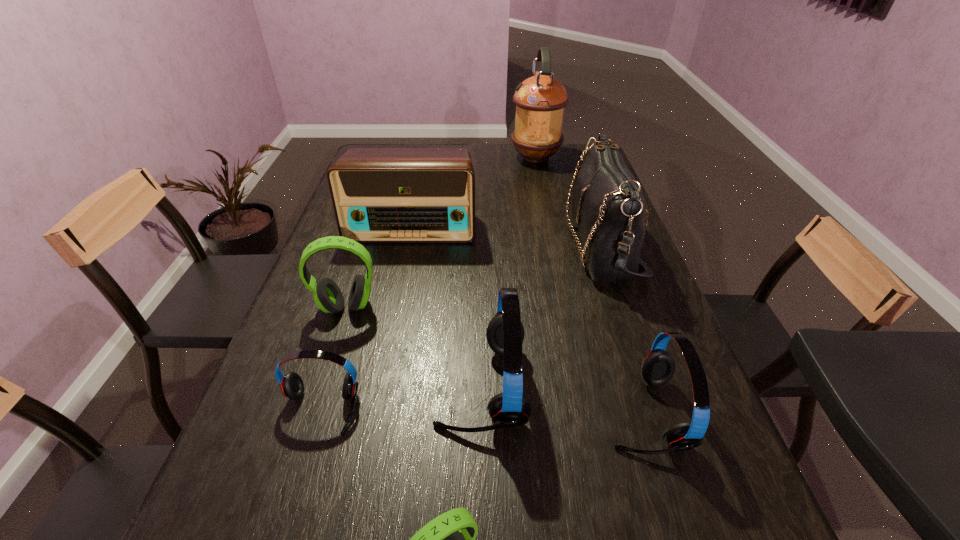
At what (x,y) coordinates should I click in order to perform the action: click on vacant space at the left edge. Please return your answer as a coordinate pair (x, y). The width and height of the screenshot is (960, 540). Looking at the image, I should click on (332, 228).

At what (x,y) coordinates should I click in order to perform the action: click on vacant space at the far right corner of the desktop. Please return your answer as a coordinate pair (x, y). Image resolution: width=960 pixels, height=540 pixels. Looking at the image, I should click on (569, 150).

This screenshot has width=960, height=540. What are the coordinates of `empty space that is in between the handbag and the radio receiver` in the screenshot? It's located at (507, 236).

This screenshot has height=540, width=960. I want to click on unoccupied area between the leftmost red headset and the radio receiver, so click(366, 318).

Image resolution: width=960 pixels, height=540 pixels. I want to click on vacant point located between the second red headset from left to right and the farther green headset, so click(x=414, y=346).

Image resolution: width=960 pixels, height=540 pixels. I want to click on vacant region between the left green headset and the second smallest red headset, so click(x=494, y=360).

Find the location of a particular element. vacant region between the second red headset from left to right and the leftmost red headset is located at coordinates click(x=401, y=397).

You are a GUI agent. You are given a task and a screenshot of the screen. Output one action in this format:
    pyautogui.click(x=<x>, y=<y>)
    Task: Click on the object that can be found as the sixth closest to the oil lamp
    This screenshot has width=960, height=540.
    Given the screenshot: What is the action you would take?
    pyautogui.click(x=292, y=386)

In order to click on the closest object to the handbag in this screenshot , I will do `click(505, 333)`.

Select which headset appears as the closest to the handbag. Please provide its 2D coordinates. Your answer should be formatted as a tuple, i.e. [(x, y)], where the tuple contains the x and y coordinates of a point satisfying the conditions above.

[(505, 333)]